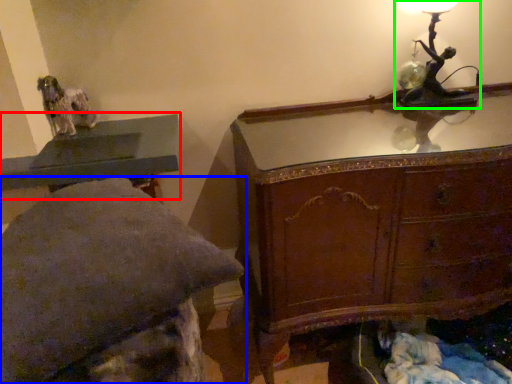
Question: Which object is positioned farthest from table (highlighted by a red box)? Select from furniture (highlighted by a blue box) and table lamp (highlighted by a green box).

Choices:
 (A) furniture
 (B) table lamp

Answer: (B)